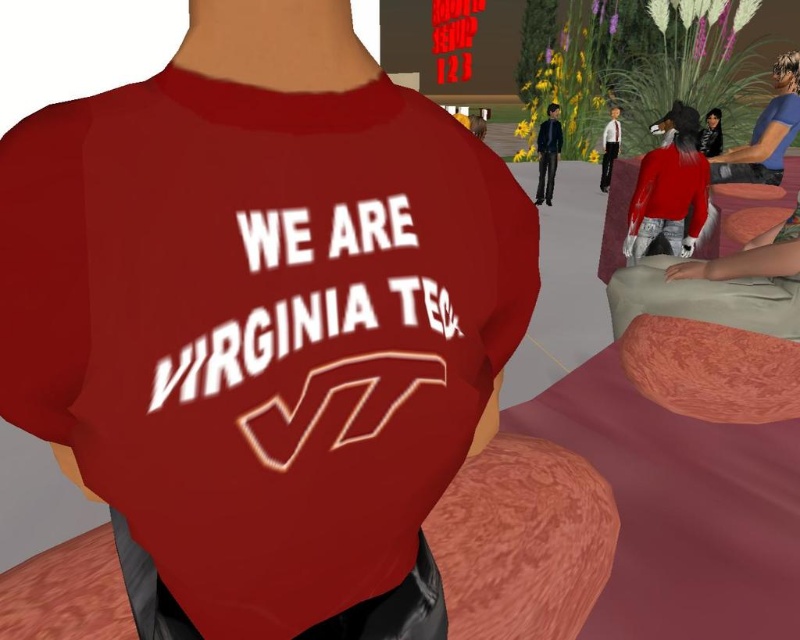
Question: Is blue fabric shirt at upper right closer to the viewer compared to matte black jacket at center?

Choices:
 (A) yes
 (B) no

Answer: (A)

Question: Which point is farther to the camera?

Choices:
 (A) matte black jacket at center
 (B) matte red t-shirt at center
 (C) blue fabric shirt at upper right
 (D) shiny black jacket at upper right

Answer: (A)

Question: Which is farther from the matte red shirt at center?

Choices:
 (A) matte black jacket at center
 (B) matte white shirt at upper right
 (C) shiny black jacket at upper right
 (D) blue fabric shirt at upper right

Answer: (B)

Question: Which point is farther to the camera?

Choices:
 (A) (554, 152)
 (B) (796, 116)
 (C) (696, 227)
 (D) (620, 120)

Answer: (D)

Question: Considering the relative positions of matte red shirt at center and blue fabric shirt at upper right in the image provided, where is matte red shirt at center located with respect to blue fabric shirt at upper right?

Choices:
 (A) below
 (B) above

Answer: (A)

Question: Is matte red t-shirt at center below shiny black jacket at upper right?

Choices:
 (A) yes
 (B) no

Answer: (A)